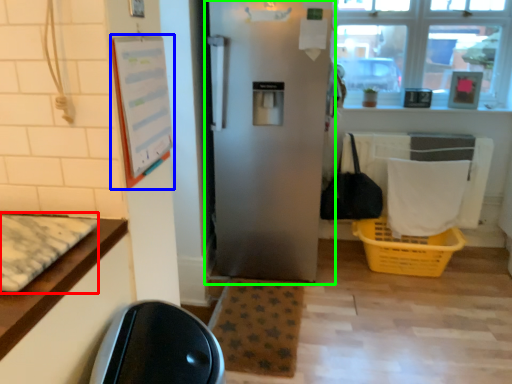
Question: Estimate the real-world distances between objects in this image. Which object is farther from mat (highlighted by a red box), bulletin board (highlighted by a blue box) or refrigerator (highlighted by a green box)?

Choices:
 (A) bulletin board
 (B) refrigerator

Answer: (B)